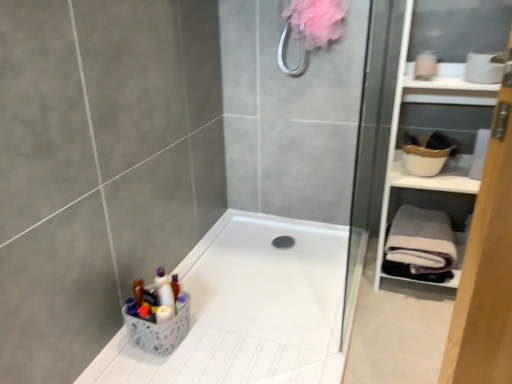
This screenshot has height=384, width=512. In order to click on vacant space behind white plastic basket at lower left in this screenshot , I will do `click(197, 288)`.